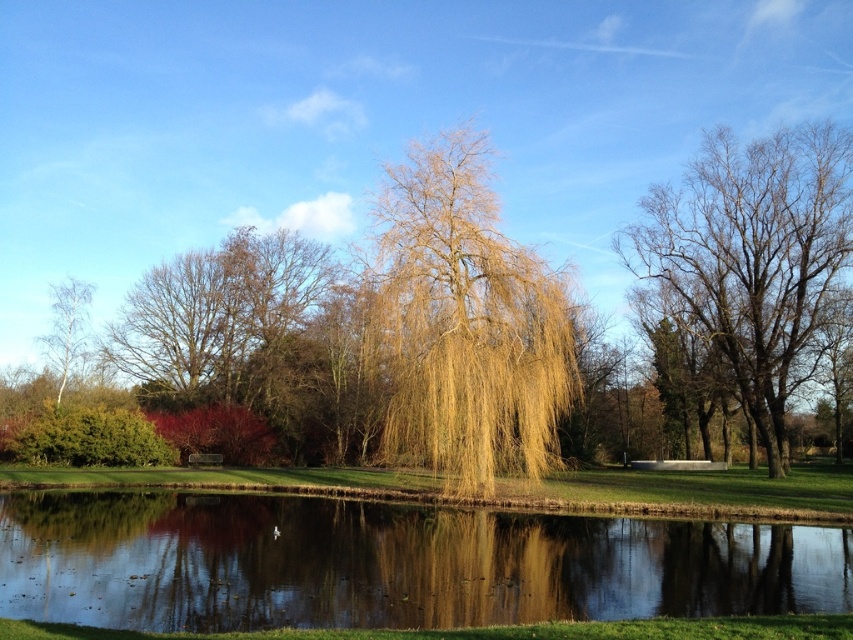
Does golden-brown textured willow at center appear under bare wood tree at right?

Indeed, golden-brown textured willow at center is positioned under bare wood tree at right.

Which is above, golden-brown textured willow at center or bare wood tree at right?

Positioned higher is bare wood tree at right.

Which is behind, point (541, 285) or point (837, 180)?

The point (837, 180) is behind.

Where is `golden-brown textured willow at center`? The image size is (853, 640). golden-brown textured willow at center is located at coordinates (466, 324).

Does reflective glass water at center have a lesser height compared to green grassy golf course at center?

Indeed, reflective glass water at center has a lesser height compared to green grassy golf course at center.

Does point (579, 534) come behind point (637, 493)?

No, it is in front of (637, 493).

Who is more distant from viewer, (778, 577) or (173, 483)?

Positioned behind is point (173, 483).

Locate an element on the screen. The image size is (853, 640). reflective glass water at center is located at coordinates (390, 564).

Which of these two, reflective glass water at center or bare wood tree at right, stands shorter?

Standing shorter between the two is reflective glass water at center.

Can you confirm if reflective glass water at center is positioned below bare wood tree at right?

Indeed, reflective glass water at center is positioned under bare wood tree at right.

At what (x,y) coordinates should I click in order to perform the action: click on reflective glass water at center. Please return your answer as a coordinate pair (x, y). This screenshot has width=853, height=640. Looking at the image, I should click on (390, 564).

This screenshot has height=640, width=853. In order to click on reflective glass water at center in this screenshot , I will do `click(390, 564)`.